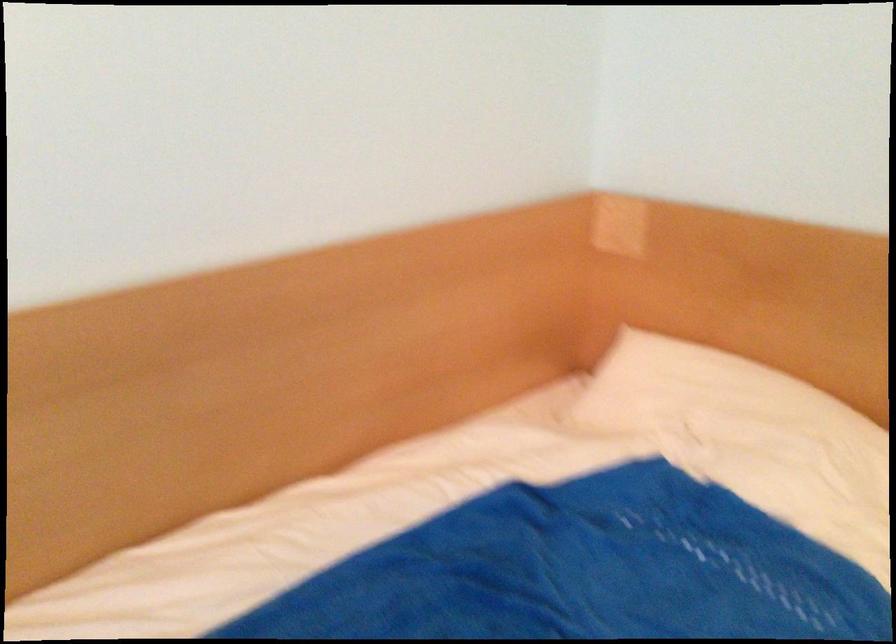
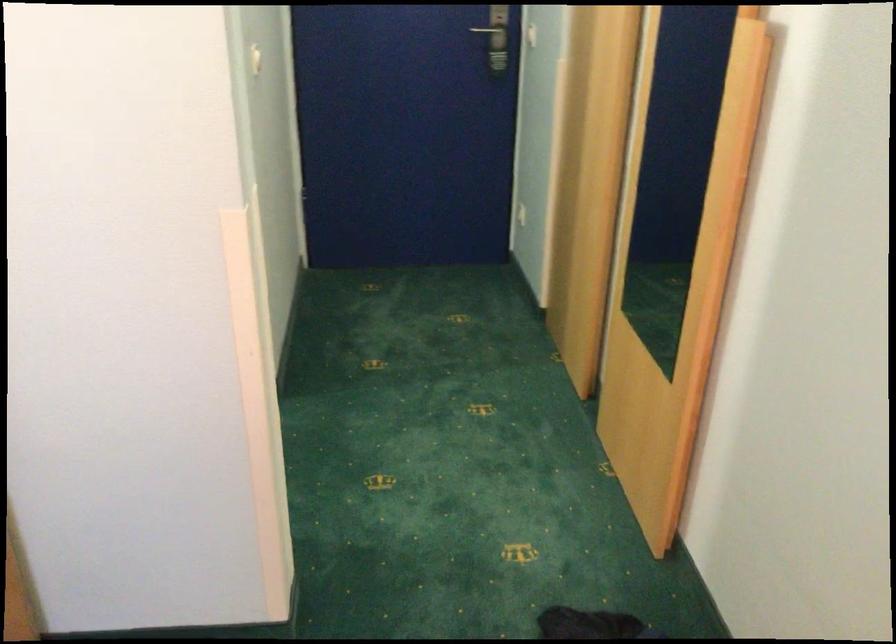
Question: The camera is either moving clockwise (left) or counter-clockwise (right) around the object. The first image is from the beginning of the video and the second image is from the end. Is the camera moving left or right when shooting the video?

Choices:
 (A) Left
 (B) Right

Answer: (A)